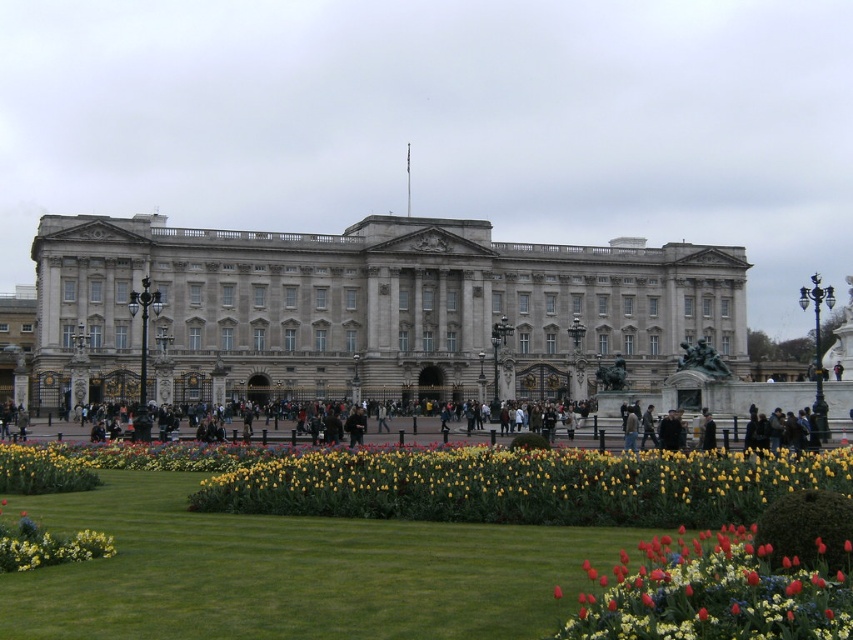
Question: Can you confirm if yellow-green grass at center is thinner than vivid red tulip at lower right?

Choices:
 (A) yes
 (B) no

Answer: (B)

Question: Which object appears farthest from the camera in this image?

Choices:
 (A) white stone building at center
 (B) yellow matte flower at lower center
 (C) vivid red tulip at lower right
 (D) yellow-green grass at center

Answer: (A)

Question: Can you confirm if yellow-green grass at center is positioned to the right of yellow matte flower at lower center?

Choices:
 (A) no
 (B) yes

Answer: (B)

Question: Which object appears closest to the camera in this image?

Choices:
 (A) white stone building at center
 (B) vivid red tulip at lower right
 (C) yellow matte flower at lower center

Answer: (B)

Question: Which of these objects is positioned closest to the yellow matte flower at lower center?

Choices:
 (A) vivid red tulip at lower right
 (B) white stone building at center

Answer: (A)

Question: Is yellow-green grass at center to the right of vivid red tulip at lower right from the viewer's perspective?

Choices:
 (A) no
 (B) yes

Answer: (A)